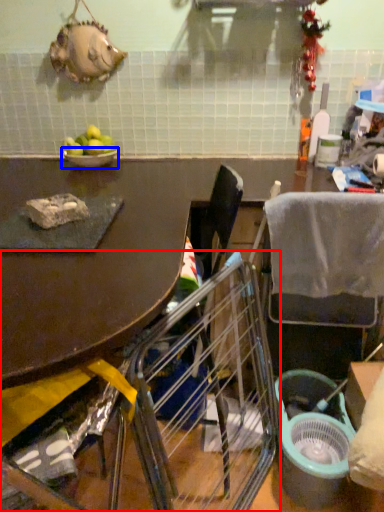
Question: Which object appears farthest to the camera in this image, chair (highlighted by a red box) or bowl (highlighted by a blue box)?

Choices:
 (A) chair
 (B) bowl

Answer: (B)